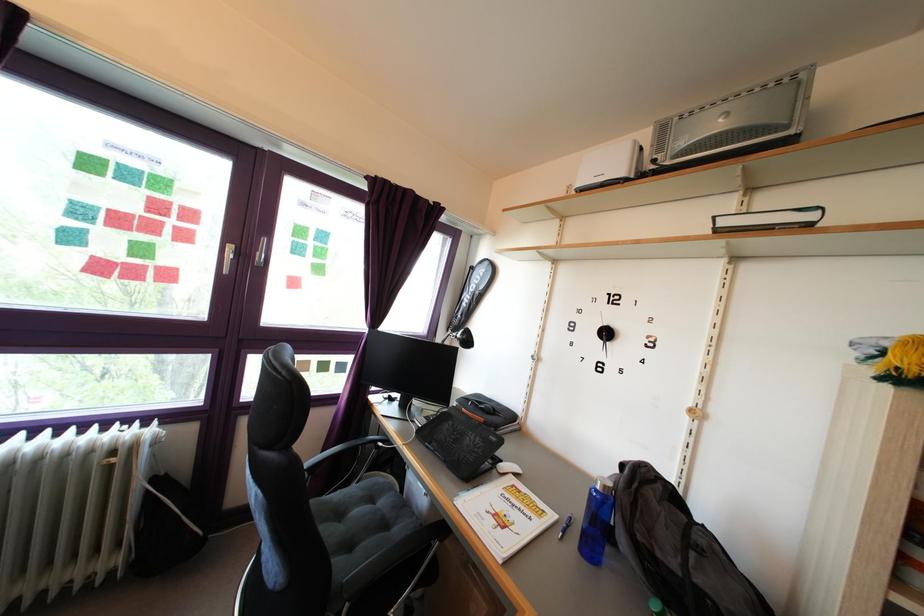
Where would you sit the chair sitting surface? Please return your answer as a coordinate pair (x, y).

(361, 521)